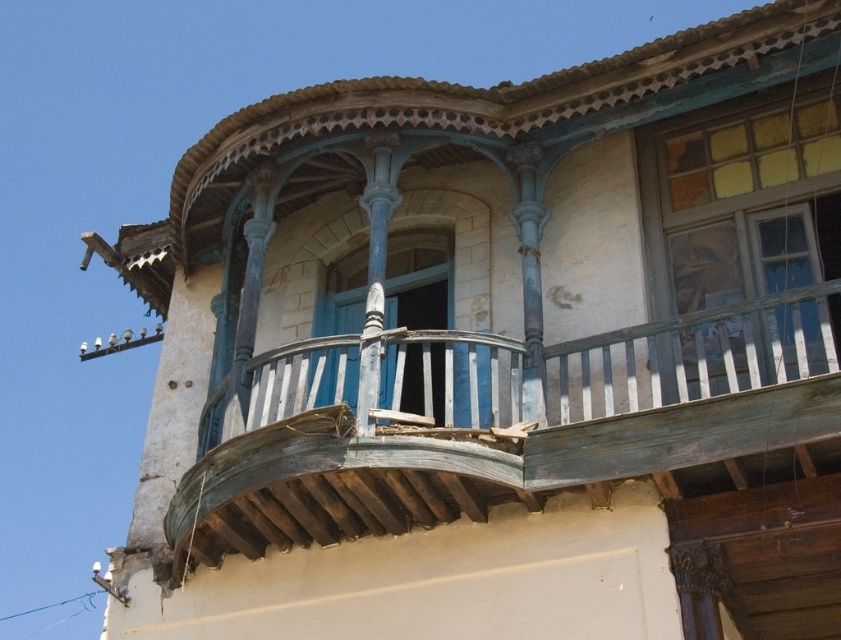
Which is above, weathered wood balcony at center or yellow glass window at upper right?

Positioned higher is yellow glass window at upper right.

Is weathered wood balcony at center thinner than yellow glass window at upper right?

No, weathered wood balcony at center is not thinner than yellow glass window at upper right.

Does point (247, 554) lie behind point (705, 262)?

No.

Find the location of a particular element. Image resolution: width=841 pixels, height=640 pixels. weathered wood balcony at center is located at coordinates (500, 422).

Between yellow glass window at upper right and blue painted wood at center, which one appears on the left side from the viewer's perspective?

blue painted wood at center is more to the left.

Based on the photo, does yellow glass window at upper right have a larger size compared to blue painted wood at center?

Yes.

You are a GUI agent. You are given a task and a screenshot of the screen. Output one action in this format:
    pyautogui.click(x=<x>, y=<y>)
    Task: Click on the yellow glass window at upper right
    
    Given the screenshot: What is the action you would take?
    pyautogui.click(x=742, y=198)

Which of these two, weathered wood balcony at center or blue painted wood at center, stands taller?

weathered wood balcony at center is taller.

Does weathered wood balcony at center have a smaller size compared to blue painted wood at center?

No.

The image size is (841, 640). What are the coordinates of `weathered wood balcony at center` in the screenshot? It's located at (500, 422).

Image resolution: width=841 pixels, height=640 pixels. Identify the location of weathered wood balcony at center. (500, 422).